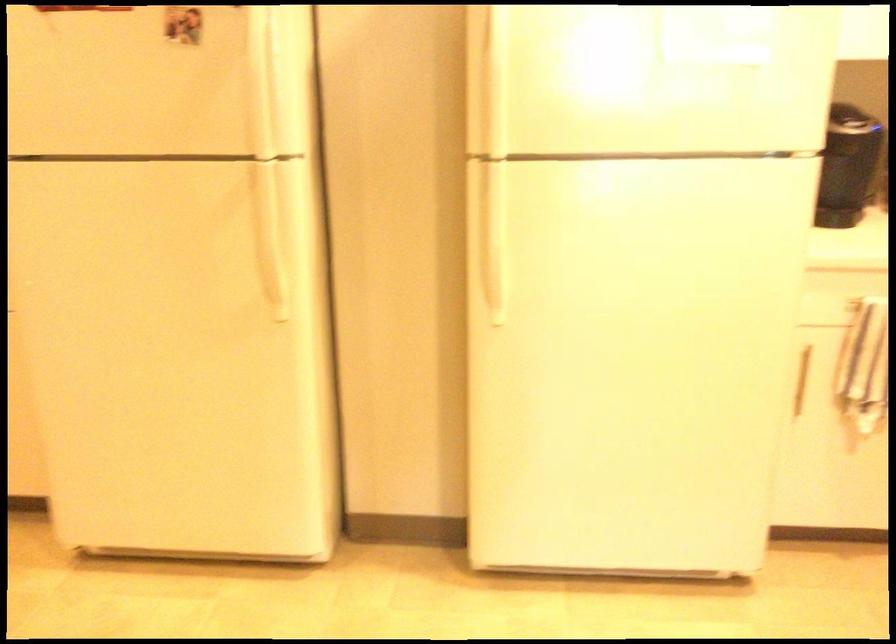
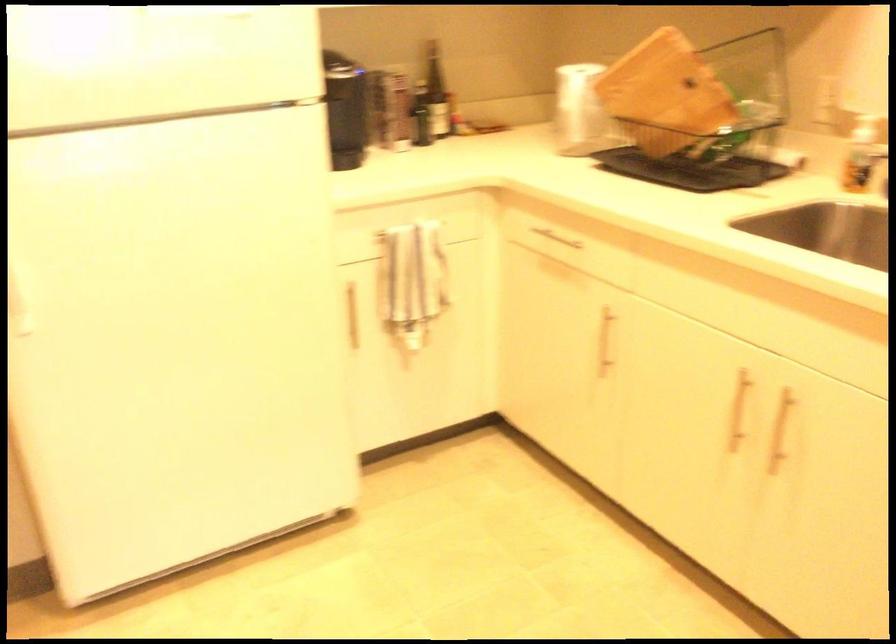
Question: How did the camera likely rotate?

Choices:
 (A) Left
 (B) Right
 (C) Up
 (D) Down

Answer: (B)